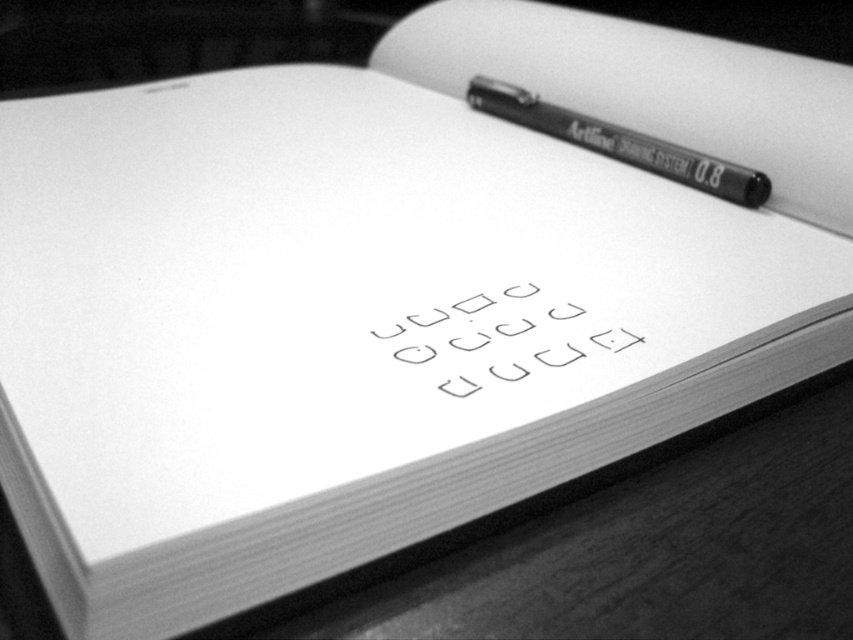
Which is behind, point (543, 316) or point (747, 173)?

Positioned behind is point (747, 173).

Where is `white paper at center`? This screenshot has height=640, width=853. white paper at center is located at coordinates (496, 337).